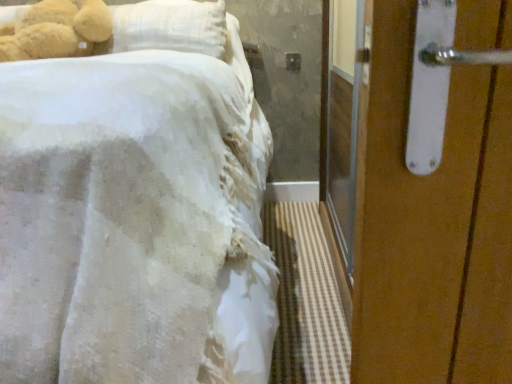
Locate an element on the screen. Image resolution: width=512 pixels, height=384 pixels. white fabric bed at left is located at coordinates coord(134,220).

Considering the sizes of objects soft plush teddy bear at upper left and white matte door handle at upper right in the image provided, who is thinner, soft plush teddy bear at upper left or white matte door handle at upper right?

With smaller width is soft plush teddy bear at upper left.

Between soft plush teddy bear at upper left and white matte door handle at upper right, which one has less height?

soft plush teddy bear at upper left.

Is soft plush teddy bear at upper left facing away from white matte door handle at upper right?

No, soft plush teddy bear at upper left is not facing away from white matte door handle at upper right.

Would you consider soft plush teddy bear at upper left to be distant from white matte door handle at upper right?

soft plush teddy bear at upper left is far away from white matte door handle at upper right.

Which object is further away from the camera taking this photo, soft plush teddy bear at upper left or white fabric bed at left?

soft plush teddy bear at upper left is further away from the camera.

Is soft plush teddy bear at upper left situated inside white fabric bed at left or outside?

soft plush teddy bear at upper left is spatially positioned inside white fabric bed at left.

Considering the relative positions of soft plush teddy bear at upper left and white fabric bed at left in the image provided, is soft plush teddy bear at upper left to the right of white fabric bed at left from the viewer's perspective?

Incorrect, soft plush teddy bear at upper left is not on the right side of white fabric bed at left.

Considering the points (90, 1) and (144, 341), which point is in front, point (90, 1) or point (144, 341)?

The point (144, 341) is in front.

Is white fabric bed at left in contact with white matte door handle at upper right?

No, white fabric bed at left is not beside white matte door handle at upper right.

Considering the points (175, 178) and (372, 327), which point is behind, point (175, 178) or point (372, 327)?

Positioned behind is point (175, 178).

From the image's perspective, would you say white fabric bed at left is shown under white matte door handle at upper right?

Yes, from the image's perspective, white fabric bed at left is below white matte door handle at upper right.

Is white fabric bed at left taller than white matte door handle at upper right?

Correct, white fabric bed at left is much taller as white matte door handle at upper right.

Considering the relative positions of white fabric bed at left and soft plush teddy bear at upper left in the image provided, is white fabric bed at left to the right of soft plush teddy bear at upper left from the viewer's perspective?

Yes.

From a real-world perspective, which is physically above, white fabric bed at left or soft plush teddy bear at upper left?

soft plush teddy bear at upper left, from a real-world perspective.

Does white fabric bed at left have a lesser height compared to soft plush teddy bear at upper left?

No, white fabric bed at left is not shorter than soft plush teddy bear at upper left.

Considering the positions of objects white fabric bed at left and soft plush teddy bear at upper left in the image provided, who is in front, white fabric bed at left or soft plush teddy bear at upper left?

Positioned in front is white fabric bed at left.

Is white matte door handle at upper right shorter than soft plush teddy bear at upper left?

In fact, white matte door handle at upper right may be taller than soft plush teddy bear at upper left.

Is white matte door handle at upper right wider or thinner than soft plush teddy bear at upper left?

white matte door handle at upper right is wider than soft plush teddy bear at upper left.

From the picture: In the image, is white matte door handle at upper right on the left side or the right side of soft plush teddy bear at upper left?

From the image, it's evident that white matte door handle at upper right is to the right of soft plush teddy bear at upper left.

Considering the sizes of objects white matte door handle at upper right and white fabric bed at left in the image provided, who is smaller, white matte door handle at upper right or white fabric bed at left?

white matte door handle at upper right.

Is white matte door handle at upper right not near white fabric bed at left?

That's not correct — white matte door handle at upper right is a little close to white fabric bed at left.

Does point (416, 312) come behind point (98, 64)?

No, (416, 312) is closer to viewer.

Find the location of a particular element. This screenshot has width=512, height=384. door that is above the white fabric bed at left (from the image's perspective) is located at coordinates (433, 226).

At what (x,y) coordinates should I click in order to perform the action: click on door below the soft plush teddy bear at upper left (from the image's perspective). Please return your answer as a coordinate pair (x, y). Looking at the image, I should click on (433, 226).

Locate an element on the screen. The image size is (512, 384). teddy bear above the white fabric bed at left (from the image's perspective) is located at coordinates (56, 30).

From the picture: When comparing their distances from white matte door handle at upper right, does soft plush teddy bear at upper left or white fabric bed at left seem closer?

white fabric bed at left.

Looking at the image, which one is located closer to soft plush teddy bear at upper left, white fabric bed at left or white matte door handle at upper right?

white fabric bed at left is positioned closer to the anchor soft plush teddy bear at upper left.

Consider the image. Based on their spatial positions, is white matte door handle at upper right or white fabric bed at left closer to soft plush teddy bear at upper left?

white fabric bed at left is positioned closer to the anchor soft plush teddy bear at upper left.

When comparing their distances from white fabric bed at left, does white matte door handle at upper right or soft plush teddy bear at upper left seem further?

soft plush teddy bear at upper left is positioned further to the anchor white fabric bed at left.

Which object lies nearer to the anchor point white matte door handle at upper right, white fabric bed at left or soft plush teddy bear at upper left?

The object closer to white matte door handle at upper right is white fabric bed at left.

Based on their spatial positions, is soft plush teddy bear at upper left or white matte door handle at upper right closer to white fabric bed at left?

white matte door handle at upper right lies closer to white fabric bed at left than the other object.

Find the location of `bed situated between soft plush teddy bear at upper left and white matte door handle at upper right from left to right`. bed situated between soft plush teddy bear at upper left and white matte door handle at upper right from left to right is located at coordinates (134, 220).